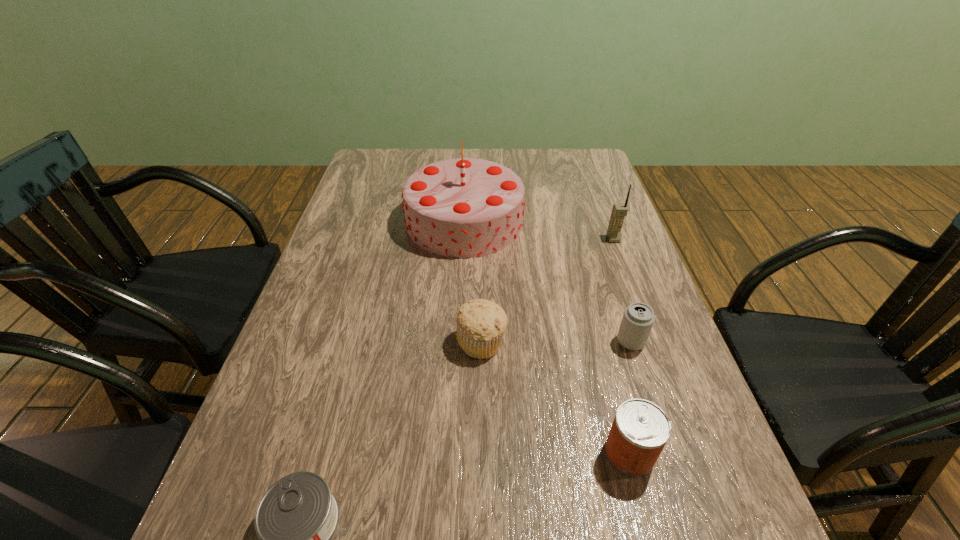
The height and width of the screenshot is (540, 960). I want to click on cellular telephone that is at the right edge, so click(619, 211).

Identify the location of blank space at the left edge of the desktop. (289, 373).

Where is `free space at the right edge of the desktop`? The image size is (960, 540). free space at the right edge of the desktop is located at coordinates pyautogui.click(x=627, y=280).

Identify the location of free space at the far left corner. The height and width of the screenshot is (540, 960). (385, 160).

Where is `free space at the far right corner`? Image resolution: width=960 pixels, height=540 pixels. free space at the far right corner is located at coordinates (600, 181).

Locate an element on the screen. This screenshot has height=540, width=960. empty location between the farthest can and the second tallest object is located at coordinates (622, 291).

This screenshot has width=960, height=540. Identify the location of blank region between the second tallest object and the farthest can. (622, 291).

Locate an element on the screen. The height and width of the screenshot is (540, 960). free point between the muffin and the farthest can is located at coordinates (557, 342).

Where is `vacant area that lies between the farthest can and the muffin`? vacant area that lies between the farthest can and the muffin is located at coordinates (557, 342).

Where is `free space between the cellular telephone and the farthest can`? Image resolution: width=960 pixels, height=540 pixels. free space between the cellular telephone and the farthest can is located at coordinates (622, 291).